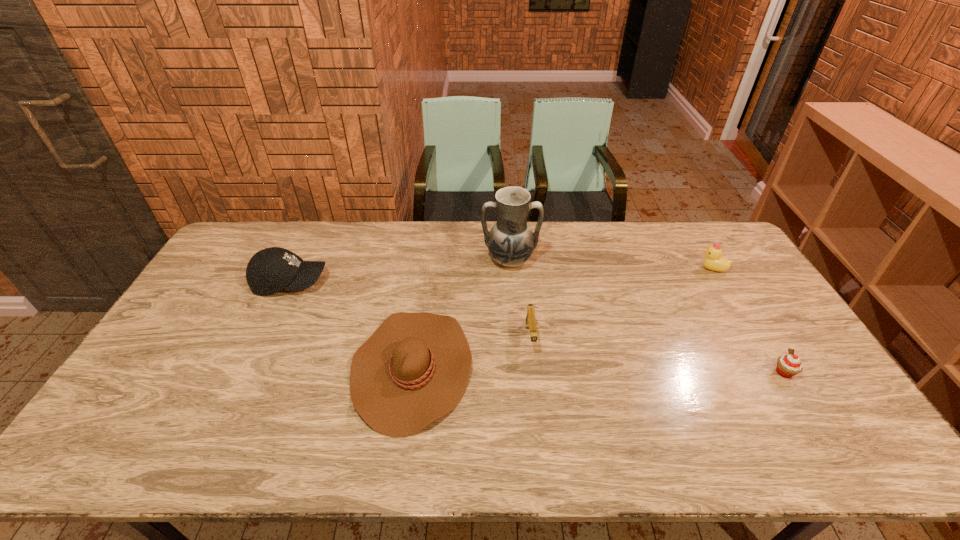
In order to click on free location located 0.150m on the front-facing side of the third tallest object in this screenshot , I will do `click(655, 269)`.

Identify the location of free region located 0.240m on the front-facing side of the third tallest object. (629, 269).

Locate an element on the screen. vacant position located at the barrel of the pistol is located at coordinates tap(543, 461).

This screenshot has height=540, width=960. In order to click on vacant space located on the left of the cupcake in this screenshot , I will do `click(704, 372)`.

Where is `vacant space located on the back of the cowboy hat`? This screenshot has height=540, width=960. vacant space located on the back of the cowboy hat is located at coordinates (428, 253).

At what (x,y) coordinates should I click in order to perform the action: click on object that is at the far edge. Please return your answer as a coordinate pair (x, y). This screenshot has height=540, width=960. Looking at the image, I should click on (511, 242).

The width and height of the screenshot is (960, 540). Identify the location of object present at the near edge. (414, 369).

The width and height of the screenshot is (960, 540). Find the location of `object located at the left edge`. object located at the left edge is located at coordinates (271, 270).

You are a GUI agent. You are given a task and a screenshot of the screen. Output one action in this format:
    pyautogui.click(x=<x>, y=<y>)
    Task: Click on the duckling that is at the right edge
    This screenshot has height=540, width=960.
    Given the screenshot: What is the action you would take?
    pyautogui.click(x=713, y=261)

This screenshot has width=960, height=540. I want to click on cupcake present at the right edge, so click(x=790, y=365).